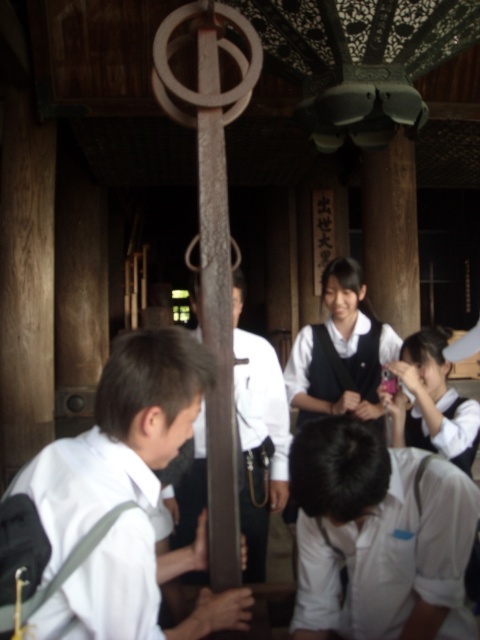
Question: Which of these objects is positioned closest to the white matte uniform at lower left?

Choices:
 (A) white matte uniform at lower center
 (B) white fabric uniform at upper right
 (C) white matte uniform at center
 (D) white matte uniform at lower right

Answer: (C)

Question: Can you confirm if white matte uniform at lower left is smaller than white matte uniform at lower right?

Choices:
 (A) no
 (B) yes

Answer: (B)

Question: Which of the following is the closest to the observer?

Choices:
 (A) (191, 282)
 (B) (298, 554)
 (C) (355, 374)

Answer: (B)

Question: Does white matte uniform at lower center appear over white matte uniform at lower right?

Choices:
 (A) no
 (B) yes

Answer: (A)

Question: Which point is farther to the camera?

Choices:
 (A) white matte uniform at lower right
 (B) white matte uniform at lower left
 (C) white fabric uniform at center
 (D) white fabric uniform at upper right

Answer: (C)

Question: Is white shirt at center thinner than white fabric uniform at upper right?

Choices:
 (A) yes
 (B) no

Answer: (B)